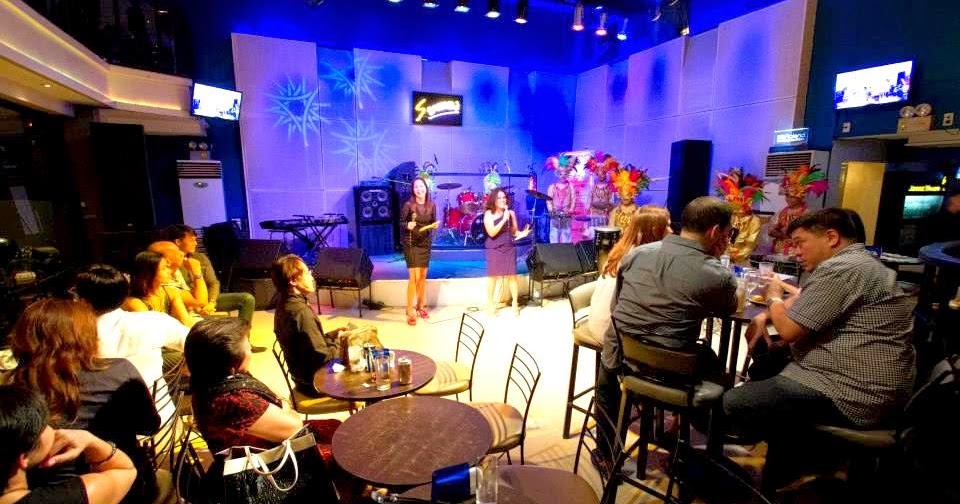
Locate an element on the screen. This screenshot has width=960, height=504. tv is located at coordinates (869, 98).